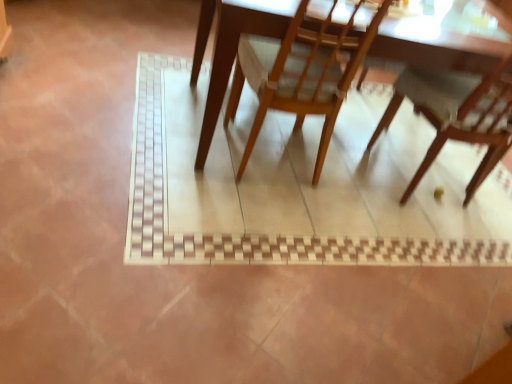
Question: Is wooden chair at lower right, which is the second chair from left to right, in front of wooden chair at center, which ranks as the 2th chair in right-to-left order?

Choices:
 (A) yes
 (B) no

Answer: (B)

Question: From a real-world perspective, does wooden chair at lower right, which is the second chair from left to right, stand above wooden chair at center, which ranks as the 2th chair in right-to-left order?

Choices:
 (A) no
 (B) yes

Answer: (B)

Question: Does wooden chair at lower right, which is the second chair from left to right, have a greater width compared to wooden chair at center, the 1th chair from the left?

Choices:
 (A) no
 (B) yes

Answer: (B)

Question: Are wooden chair at lower right, acting as the first chair starting from the right, and wooden chair at center, the 1th chair from the left, located far from each other?

Choices:
 (A) yes
 (B) no

Answer: (B)

Question: Considering the relative sizes of wooden chair at lower right, acting as the first chair starting from the right, and wooden chair at center, the 1th chair from the left, in the image provided, is wooden chair at lower right, acting as the first chair starting from the right, bigger than wooden chair at center, the 1th chair from the left,?

Choices:
 (A) yes
 (B) no

Answer: (A)

Question: Can you confirm if wooden chair at lower right, acting as the first chair starting from the right, is taller than wooden chair at center, which ranks as the 2th chair in right-to-left order?

Choices:
 (A) no
 (B) yes

Answer: (B)

Question: Considering the relative sizes of wooden chair at lower right, which is the second chair from left to right, and wooden table at center in the image provided, is wooden chair at lower right, which is the second chair from left to right, taller than wooden table at center?

Choices:
 (A) yes
 (B) no

Answer: (A)

Question: From the image's perspective, would you say wooden chair at lower right, which is the second chair from left to right, is shown under wooden table at center?

Choices:
 (A) yes
 (B) no

Answer: (A)

Question: Considering the relative sizes of wooden chair at lower right, which is the second chair from left to right, and wooden table at center in the image provided, is wooden chair at lower right, which is the second chair from left to right, smaller than wooden table at center?

Choices:
 (A) yes
 (B) no

Answer: (A)

Question: Is wooden chair at lower right, acting as the first chair starting from the right, wider than wooden table at center?

Choices:
 (A) yes
 (B) no

Answer: (B)

Question: From a real-world perspective, is wooden chair at lower right, acting as the first chair starting from the right, located higher than wooden table at center?

Choices:
 (A) yes
 (B) no

Answer: (A)

Question: Is wooden table at center surrounded by wooden chair at lower right, which is the second chair from left to right?

Choices:
 (A) yes
 (B) no

Answer: (B)

Question: Can we say wooden table at center lies outside wooden chair at lower right, which is the second chair from left to right?

Choices:
 (A) no
 (B) yes

Answer: (B)